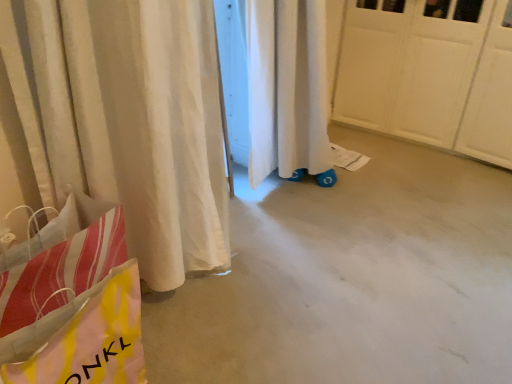
Question: From the image's perspective, is yellow and pink plastic bag at lower left located beneath smooth concrete floor at center?

Choices:
 (A) no
 (B) yes

Answer: (B)

Question: Can you confirm if yellow and pink plastic bag at lower left is positioned to the right of smooth concrete floor at center?

Choices:
 (A) no
 (B) yes

Answer: (A)

Question: Could you tell me if yellow and pink plastic bag at lower left is facing smooth concrete floor at center?

Choices:
 (A) no
 (B) yes

Answer: (A)

Question: Is yellow and pink plastic bag at lower left not close to smooth concrete floor at center?

Choices:
 (A) yes
 (B) no

Answer: (B)

Question: Does yellow and pink plastic bag at lower left have a lesser height compared to smooth concrete floor at center?

Choices:
 (A) yes
 (B) no

Answer: (B)

Question: From a real-world perspective, is yellow and pink plastic bag at lower left below smooth concrete floor at center?

Choices:
 (A) no
 (B) yes

Answer: (A)

Question: Is yellow and pink plastic bag at lower left a part of smooth concrete floor at center?

Choices:
 (A) no
 (B) yes

Answer: (A)

Question: Is smooth concrete floor at center placed right next to yellow and pink plastic bag at lower left?

Choices:
 (A) yes
 (B) no

Answer: (B)

Question: Is smooth concrete floor at center taller than yellow and pink plastic bag at lower left?

Choices:
 (A) no
 (B) yes

Answer: (A)

Question: Is smooth concrete floor at center bigger than yellow and pink plastic bag at lower left?

Choices:
 (A) no
 (B) yes

Answer: (B)

Question: Is smooth concrete floor at center at the left side of yellow and pink plastic bag at lower left?

Choices:
 (A) no
 (B) yes

Answer: (A)

Question: From the image's perspective, does smooth concrete floor at center appear lower than yellow and pink plastic bag at lower left?

Choices:
 (A) yes
 (B) no

Answer: (B)

Question: Is smooth concrete floor at center bigger or smaller than yellow and pink plastic bag at lower left?

Choices:
 (A) big
 (B) small

Answer: (A)